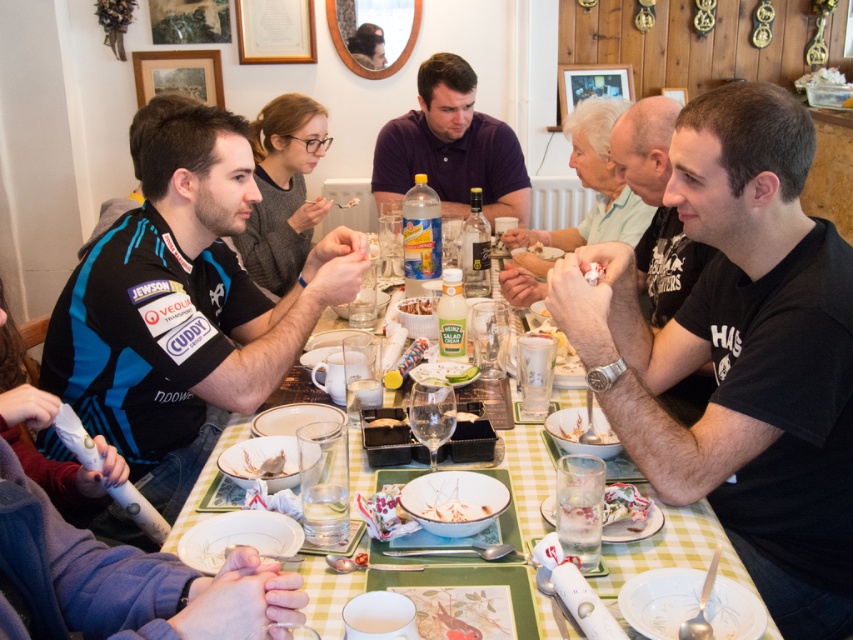
Question: Among these objects, which one is nearest to the camera?

Choices:
 (A) purple cotton shirt at center
 (B) white paper napkin at lower center

Answer: (B)

Question: Where is purple cotton shirt at center located in relation to white matte plate at center in the image?

Choices:
 (A) above
 (B) below

Answer: (A)

Question: Can you confirm if matte gray sweater at center is thinner than white creamy pasta at center?

Choices:
 (A) yes
 (B) no

Answer: (B)

Question: Based on their relative distances, which object is nearer to the white creamy cake at center?

Choices:
 (A) purple cotton shirt at center
 (B) white paper napkin at lower center

Answer: (B)

Question: Among these points, which one is nearest to the camera?

Choices:
 (A) (550, 416)
 (B) (462, 520)
 (C) (215, 433)

Answer: (B)

Question: Can you confirm if white paper napkin at lower center is wider than clear plastic cup at center?

Choices:
 (A) yes
 (B) no

Answer: (A)